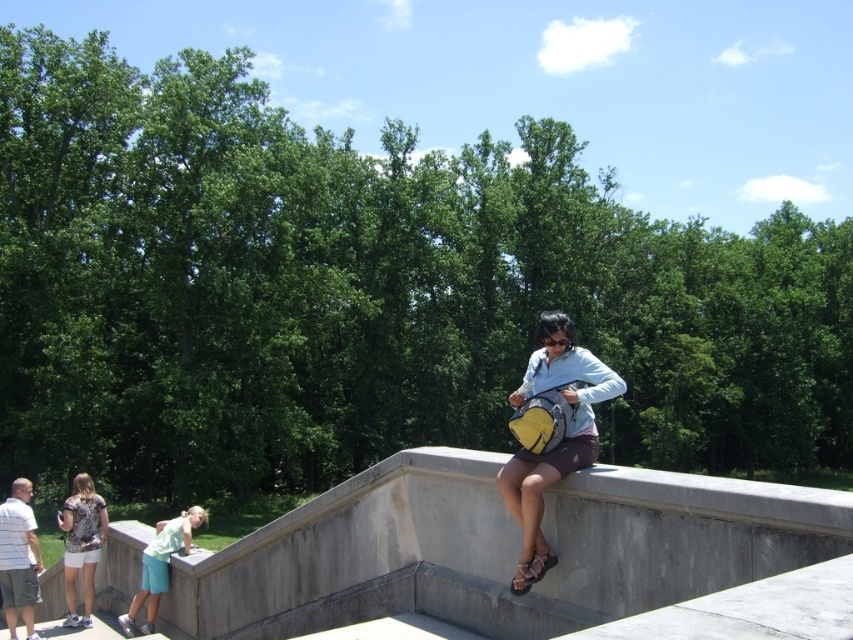
Question: Is matte yellow backpack at center above printed fabric shirt at lower left?

Choices:
 (A) yes
 (B) no

Answer: (A)

Question: Based on their relative distances, which object is farther from the light blue denim shorts at lower left?

Choices:
 (A) printed fabric shirt at lower left
 (B) matte yellow backpack at center

Answer: (B)

Question: Observing the image, what is the correct spatial positioning of matte yellow backpack at center in reference to printed fabric shirt at lower left?

Choices:
 (A) below
 (B) above

Answer: (B)

Question: Does printed fabric shirt at lower left appear over light blue denim shorts at lower left?

Choices:
 (A) yes
 (B) no

Answer: (A)

Question: Which of the following is the closest to the observer?

Choices:
 (A) pos(65,572)
 (B) pos(155,529)
 (C) pos(543,356)

Answer: (C)

Question: Which object is positioned farthest from the matte yellow backpack at center?

Choices:
 (A) printed fabric shirt at lower left
 (B) light blue denim shorts at lower left

Answer: (A)